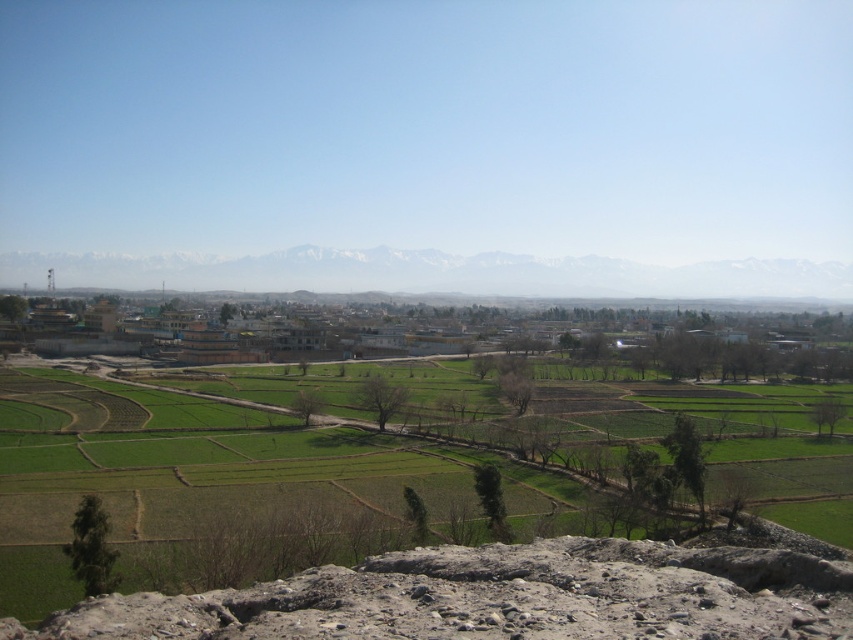
Question: Is green grassland at center behind snowy white mountain at upper center?

Choices:
 (A) yes
 (B) no

Answer: (B)

Question: Which point is farther to the camera?

Choices:
 (A) green grassland at center
 (B) snowy white mountain at upper center

Answer: (B)

Question: Which point is closer to the camera?

Choices:
 (A) (827, 593)
 (B) (183, 275)

Answer: (A)

Question: Can you confirm if green grassland at center is positioned to the left of snowy white mountain at upper center?

Choices:
 (A) yes
 (B) no

Answer: (B)

Question: Considering the relative positions of green grassland at center and snowy white mountain at upper center in the image provided, where is green grassland at center located with respect to snowy white mountain at upper center?

Choices:
 (A) left
 (B) right

Answer: (B)